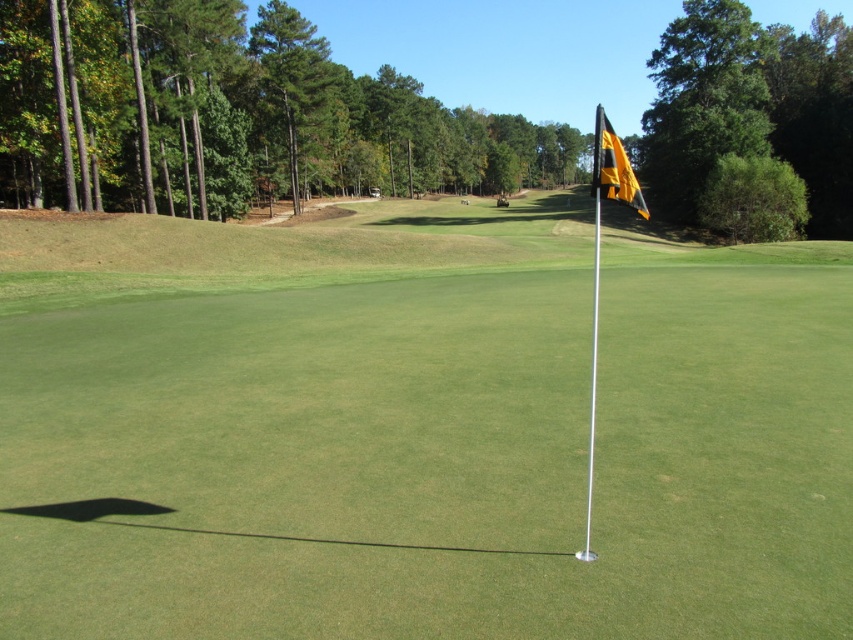
Is metallic flag at center wider than black/yellow fabric flag at upper right?

Indeed, metallic flag at center has a greater width compared to black/yellow fabric flag at upper right.

Is metallic flag at center smaller than black/yellow fabric flag at upper right?

No, metallic flag at center is not smaller than black/yellow fabric flag at upper right.

Between point (381, 563) and point (596, 166), which one is positioned in front?

Point (596, 166) is in front.

At what (x,y) coordinates should I click in order to perform the action: click on metallic flag at center. Please return your answer as a coordinate pair (x, y). The height and width of the screenshot is (640, 853). Looking at the image, I should click on (419, 428).